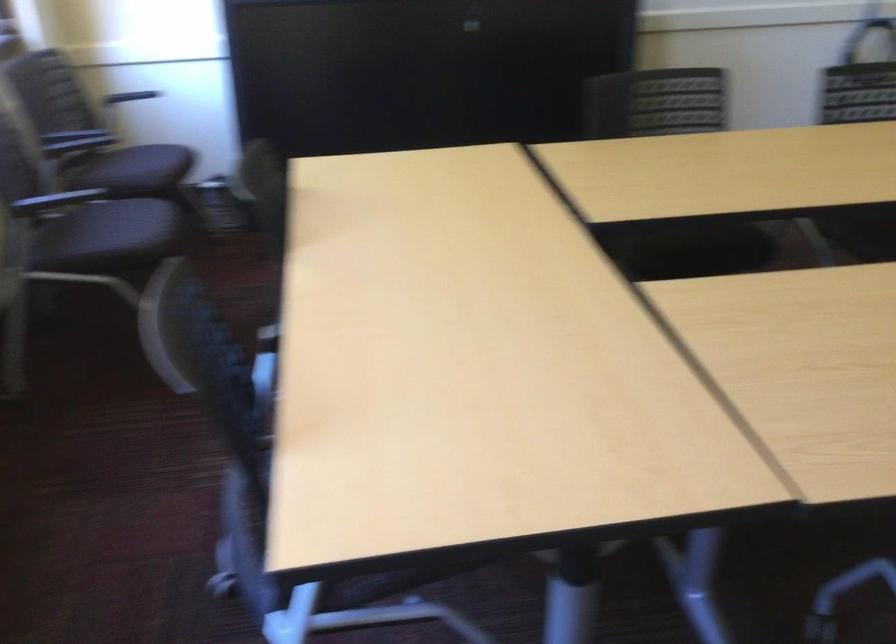
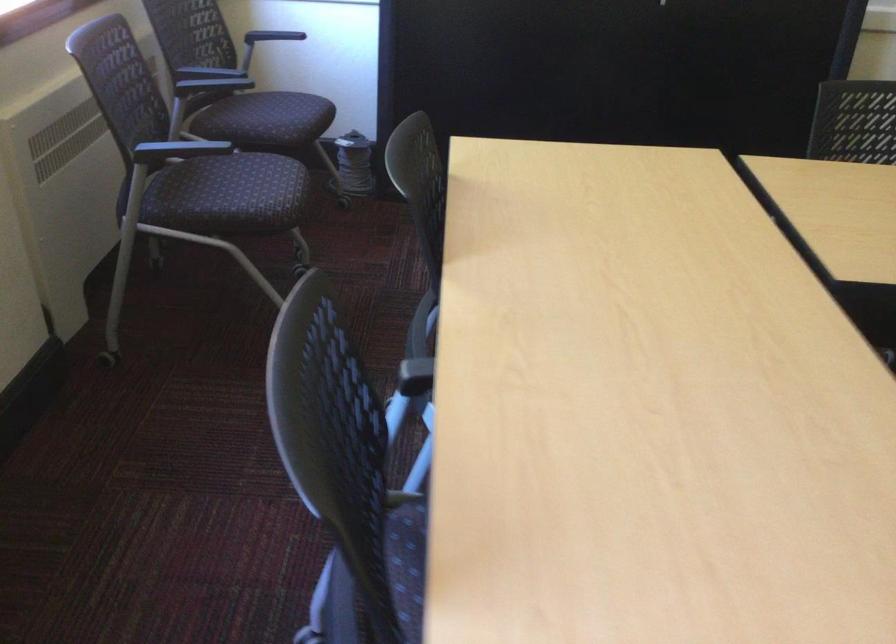
Where in the second image is the point corresponding to (135,172) from the first image?

(271, 120)